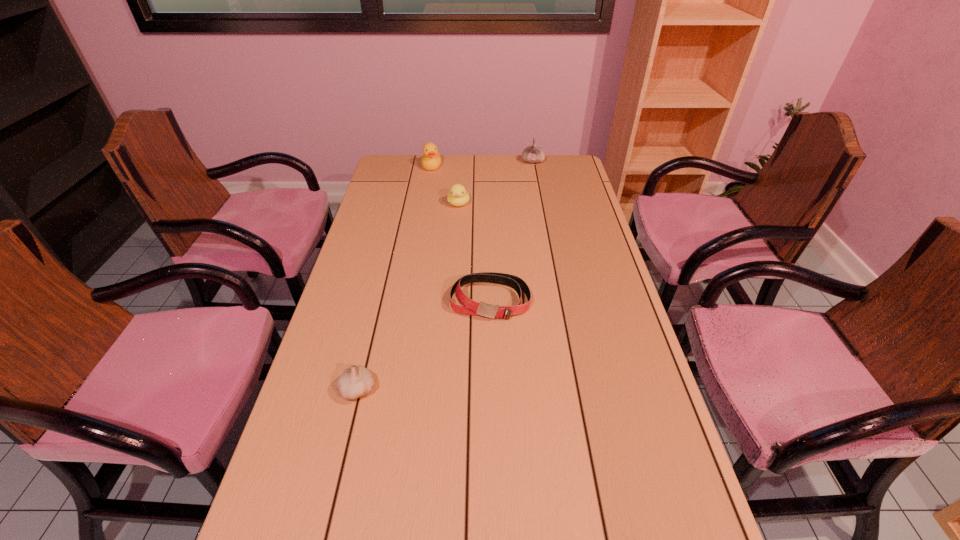
Identify the location of the farther garlic. (533, 154).

Where is `the right garlic`? The image size is (960, 540). the right garlic is located at coordinates (533, 154).

The width and height of the screenshot is (960, 540). I want to click on duck, so click(x=431, y=160).

Where is `the third farthest object`? the third farthest object is located at coordinates (457, 196).

Locate an element on the screen. The image size is (960, 540). the nearest object is located at coordinates (356, 381).

Where is `the left garlic`? the left garlic is located at coordinates (356, 381).

Image resolution: width=960 pixels, height=540 pixels. Find the location of `the second nearest object`. the second nearest object is located at coordinates 468,306.

Where is `free space located 0.060m on the left of the taller garlic`? Image resolution: width=960 pixels, height=540 pixels. free space located 0.060m on the left of the taller garlic is located at coordinates click(507, 161).

Locate an element on the screen. free space located 0.090m at the beak of the duck is located at coordinates (429, 185).

This screenshot has height=540, width=960. I want to click on free region located 0.160m at the beak of the duckling, so click(x=456, y=237).